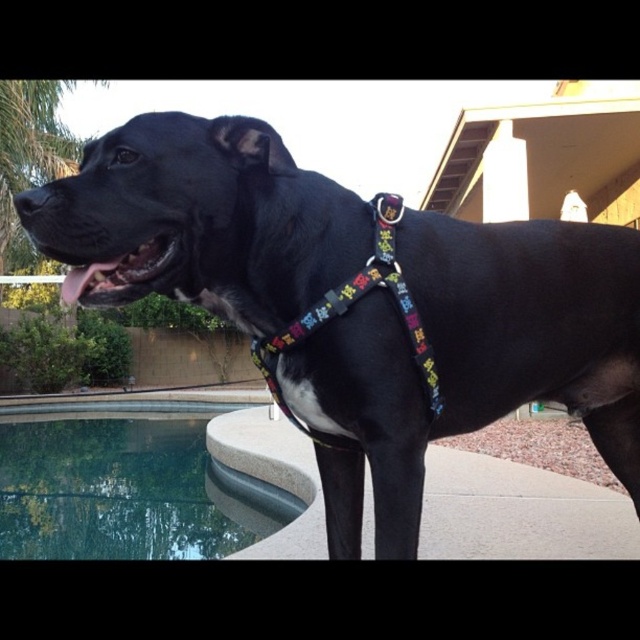
You are a dog owner who wants to choose between the black matte harness at center and the multicolored fabric harness at center for your dog. Based on their sizes, which harness would be more suitable for a dog with a larger neck?

The black matte harness at center is much taller than the multicolored fabric harness at center, so it would be more suitable for a dog with a larger neck.

You are a photographer trying to capture the black dog in the scene. You need to ensure that both the black matte harness at center and the clear glass water at lower left are visible in your shot. Considering their relative heights, which object should you focus on first to frame the shot properly?

The black matte harness at center has a lesser height compared to the clear glass water at lower left. To frame the shot properly, focus on the clear glass water at lower left first since it is taller and will help establish the vertical composition.